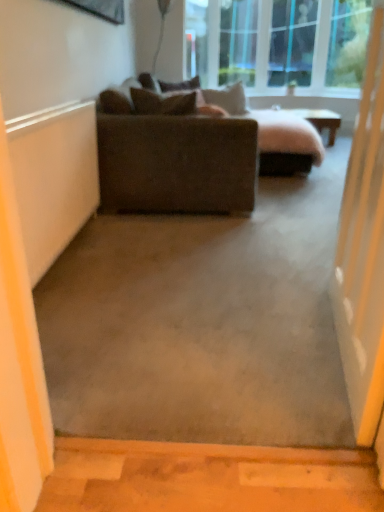
Question: Is transparent glass screen door at right closer to the viewer compared to wooden table at center?

Choices:
 (A) no
 (B) yes

Answer: (B)

Question: Is the surface of transparent glass screen door at right in direct contact with wooden table at center?

Choices:
 (A) yes
 (B) no

Answer: (B)

Question: Would you say wooden table at center is part of transparent glass screen door at right's contents?

Choices:
 (A) no
 (B) yes

Answer: (A)

Question: Is transparent glass screen door at right positioned far away from wooden table at center?

Choices:
 (A) yes
 (B) no

Answer: (A)

Question: Is transparent glass screen door at right bigger than wooden table at center?

Choices:
 (A) yes
 (B) no

Answer: (B)

Question: Is transparent glass screen door at right wider than wooden table at center?

Choices:
 (A) no
 (B) yes

Answer: (A)

Question: Can you confirm if wooden table at center is thinner than suede-like beige pillow at upper center, the 2th pillow in the back-to-front sequence?

Choices:
 (A) yes
 (B) no

Answer: (B)

Question: Is suede-like beige pillow at upper center, the 2th pillow in the back-to-front sequence, surrounded by wooden table at center?

Choices:
 (A) no
 (B) yes

Answer: (A)

Question: Can you confirm if wooden table at center is positioned to the right of suede-like beige pillow at upper center, the 2th pillow in the back-to-front sequence?

Choices:
 (A) no
 (B) yes

Answer: (B)

Question: Is wooden table at center oriented away from suede-like beige pillow at upper center, which is the third pillow in front-to-back order?

Choices:
 (A) yes
 (B) no

Answer: (B)

Question: Considering the relative sizes of wooden table at center and suede-like beige pillow at upper center, which is the third pillow in front-to-back order, in the image provided, is wooden table at center wider than suede-like beige pillow at upper center, which is the third pillow in front-to-back order,?

Choices:
 (A) no
 (B) yes

Answer: (B)

Question: From the image's perspective, is wooden table at center above suede-like beige pillow at upper center, which is the third pillow in front-to-back order?

Choices:
 (A) yes
 (B) no

Answer: (A)

Question: Is suede-like beige pillow at upper center, which is the third pillow in front-to-back order, placed right next to suede-like brown pillow at upper center, which is counted as the second pillow, starting from the front?

Choices:
 (A) yes
 (B) no

Answer: (B)